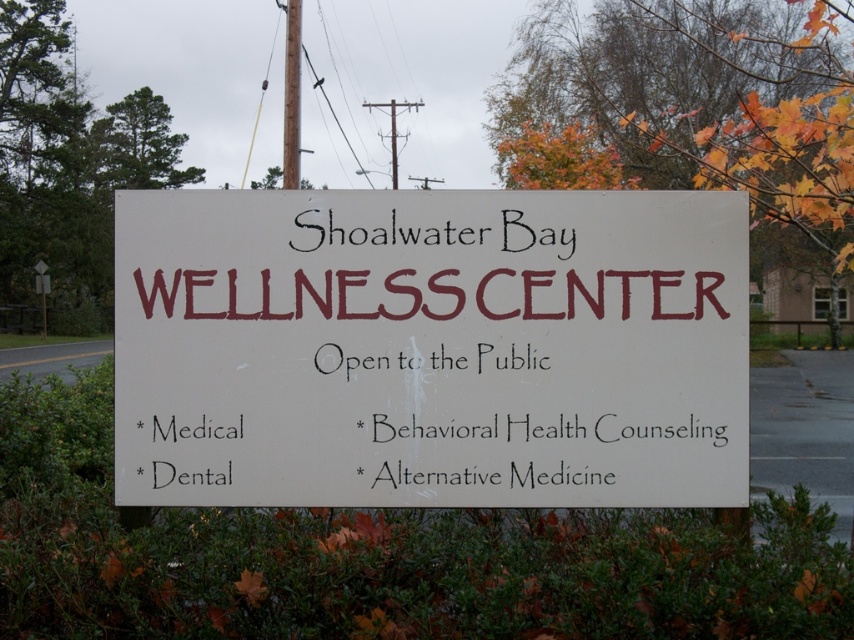
You are driving past the Shoalwater Bay Wellness Center signboard and notice two signs. One is the white matte sign at center and the other is the white plastic sign at upper center. Which one is positioned to the right of the other?

The white matte sign at center is to the right of the white plastic sign at upper center.

You are standing at the entrance of the Shoalwater Bay Wellness Center and want to locate the white matte sign at center. According to the scene description, where should you look?

You should look at point (430, 348) to find the white matte sign at center.

You are standing at the point marked by the coordinate point at point (699, 390). You want to walk to the Wellness Center entrance, which is 3.94 meters away from your current position. Is the Wellness Center entrance located to your north, south, east, or west?

The Wellness Center entrance is 3.94 meters away from the point marked by the coordinate point at point (699, 390). However, without additional information about the direction of travel or the layout of the area, it is impossible to determine the compass direction to the Wellness Center entrance based solely on the distance provided.